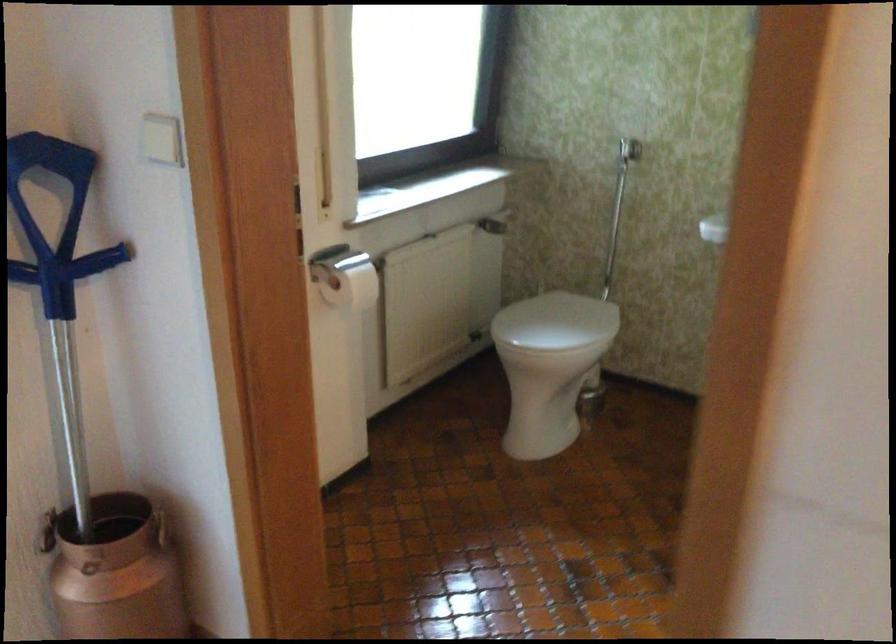
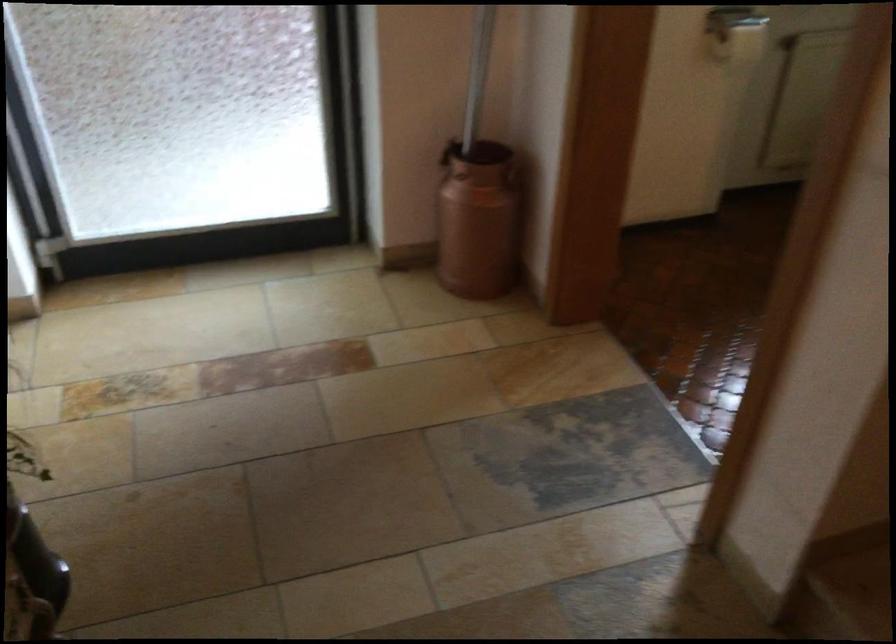
Where in the second image is the point corresponding to (x=80, y=424) from the first image?

(478, 73)